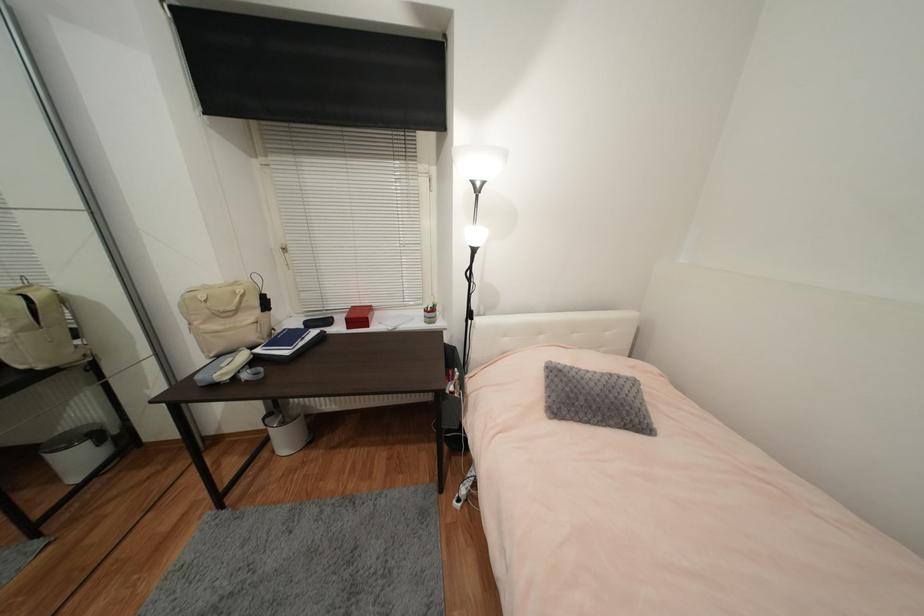
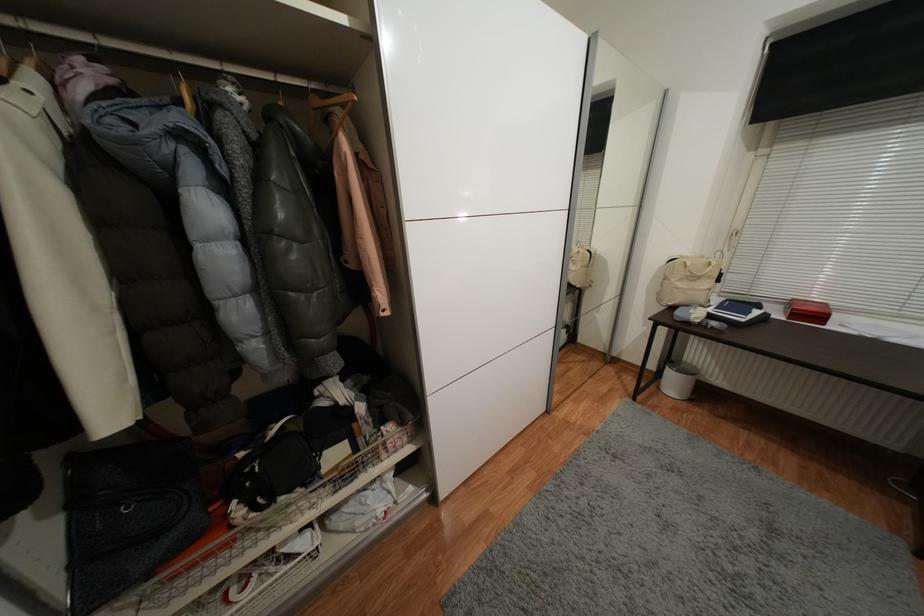
Locate, in the second image, the point that corresponds to the point at 277,453 in the first image.

(663, 390)